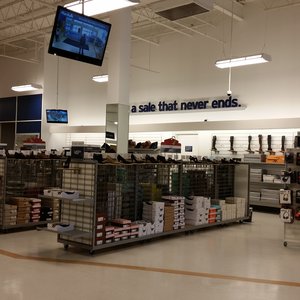
What are the coordinates of `gold line across floor` in the screenshot? It's located at (122, 264).